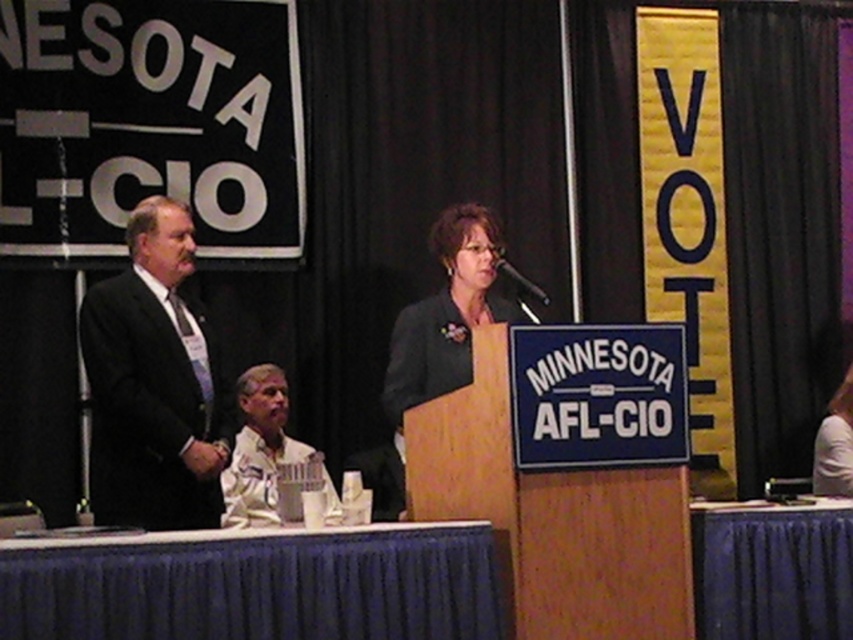
You are standing at the front of the event and want to place a small flower bouquet between the two points marked as point (x=254, y=467) and point (x=523, y=276). Which point should the bouquet be closer to in order to be nearer to the audience?

The bouquet should be closer to point (x=254, y=467) because it is nearer to the audience than point (x=523, y=276).